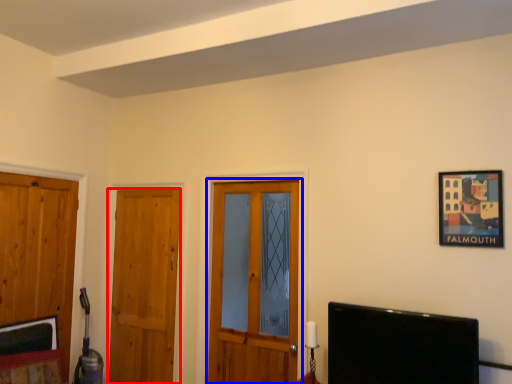
Question: Which object is closer to the camera taking this photo, door (highlighted by a red box) or door (highlighted by a blue box)?

Choices:
 (A) door
 (B) door

Answer: (B)